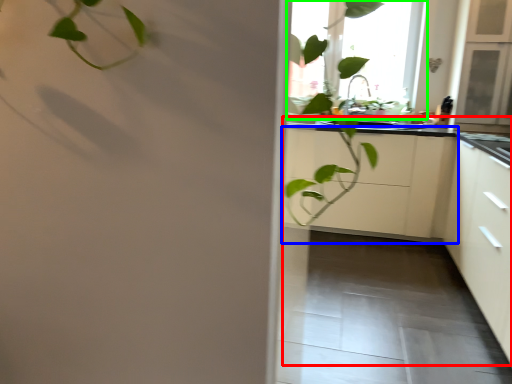
Question: Considering the real-world distances, which object is farthest from counter top (highlighted by a red box)? cabinetry (highlighted by a blue box) or window (highlighted by a green box)?

Choices:
 (A) cabinetry
 (B) window

Answer: (B)